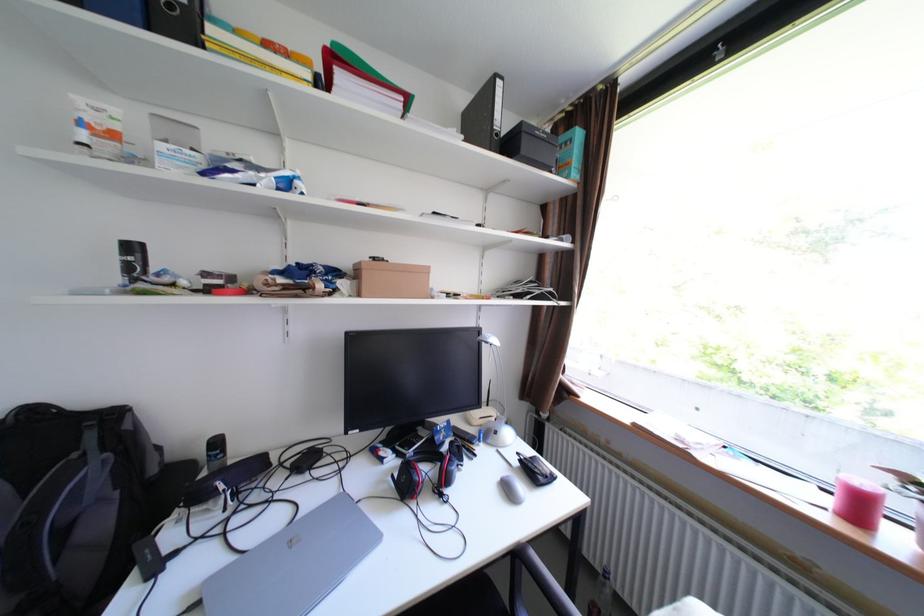
Find where to lift the black phone. Please return your answer as a coordinate pair (x, y).

(225, 479)